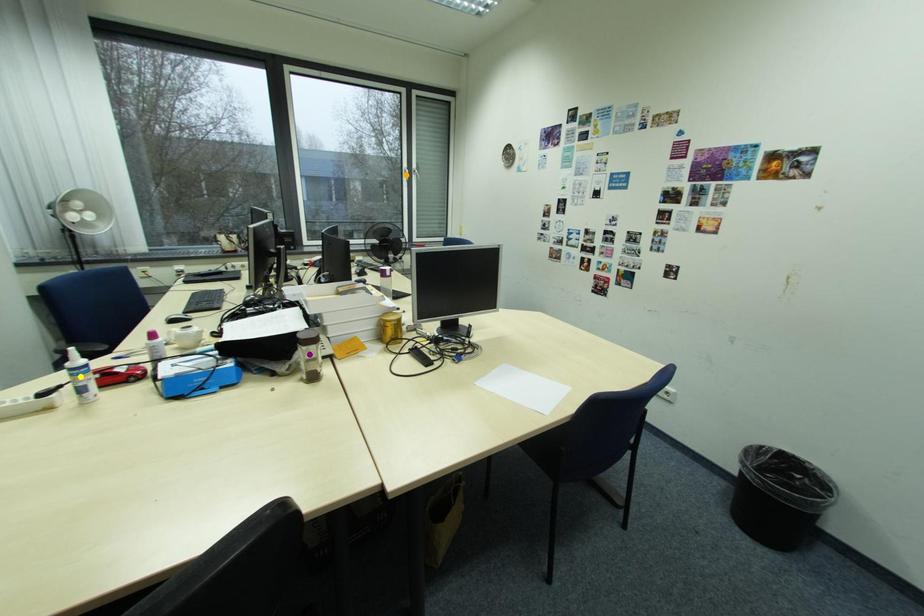
Order these from farthest to nearest:
1. yellow point
2. purple point
3. orange point

1. orange point
2. purple point
3. yellow point